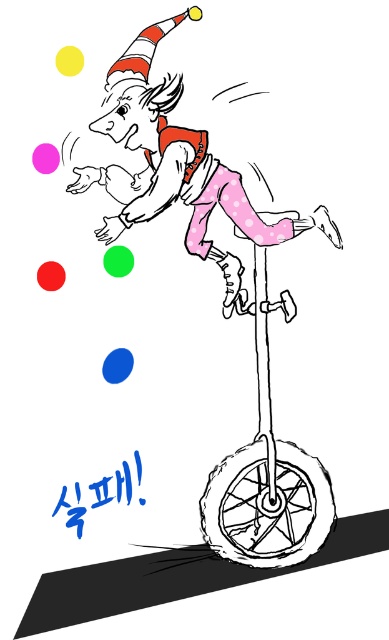
Question: Which point appears farthest from the camera in this image?

Choices:
 (A) (301, 461)
 (B) (124, 138)
 (C) (248, 460)

Answer: (A)

Question: Based on their relative distances, which object is farther from the black rubber scooter at center?

Choices:
 (A) black rubber wheel at lower center
 (B) pink dotted pants at center

Answer: (B)

Question: Does pink dotted pants at center have a smaller size compared to black rubber scooter at center?

Choices:
 (A) no
 (B) yes

Answer: (A)

Question: Where is pink dotted pants at center located in relation to black rubber scooter at center in the image?

Choices:
 (A) below
 (B) above

Answer: (B)

Question: Is the position of pink dotted pants at center more distant than that of black rubber wheel at lower center?

Choices:
 (A) no
 (B) yes

Answer: (A)

Question: Which object appears farthest from the camera in this image?

Choices:
 (A) black rubber scooter at center
 (B) pink dotted pants at center

Answer: (A)